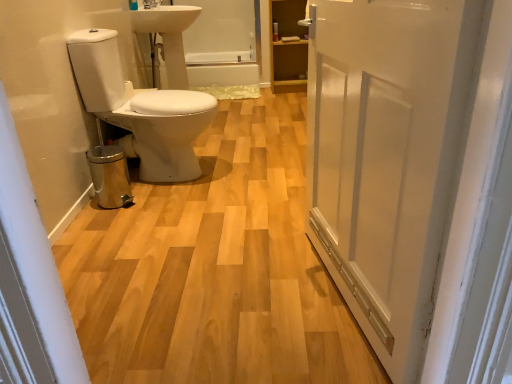
Identify the location of vacant area that is in front of white glossy toilet at left. Image resolution: width=512 pixels, height=384 pixels. (165, 208).